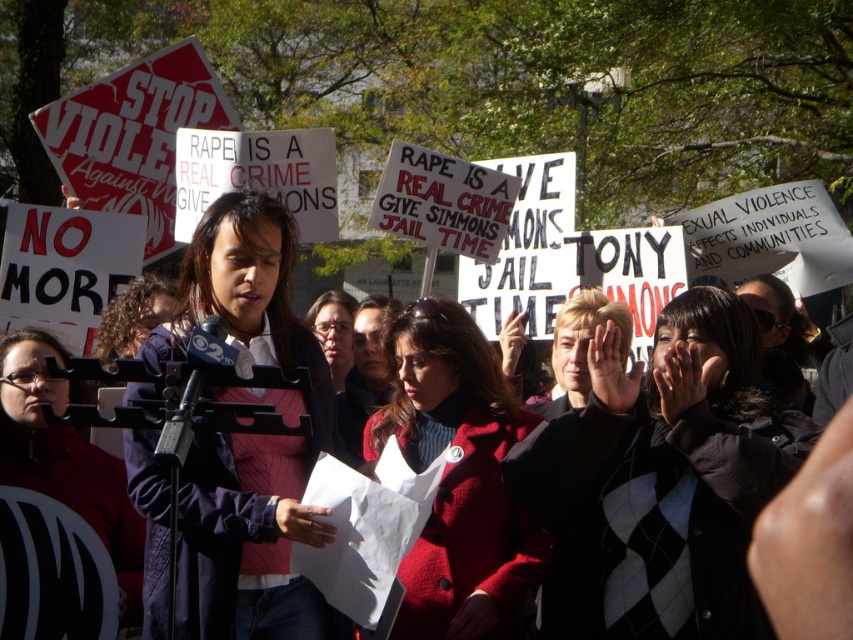
Does point (526, 593) come closer to viewer compared to point (27, 332)?

Yes, point (526, 593) is in front of point (27, 332).

Does red wool coat at center have a lesser width compared to matte black microphone at center?

Indeed, red wool coat at center has a lesser width compared to matte black microphone at center.

This screenshot has width=853, height=640. Describe the element at coordinates (457, 477) in the screenshot. I see `red wool coat at center` at that location.

Identify the location of red wool coat at center. This screenshot has height=640, width=853. (457, 477).

Does black argyle sweater at center appear on the left side of matte black microphone at center?

In fact, black argyle sweater at center is to the right of matte black microphone at center.

Which of these two, black argyle sweater at center or matte black microphone at center, stands taller?

Standing taller between the two is matte black microphone at center.

Between point (624, 529) and point (108, 540), which one is positioned behind?

The point (108, 540) is behind.

What are the coordinates of `black argyle sweater at center` in the screenshot? It's located at (660, 481).

Which is more to the right, black argyle sweater at center or dark blue jacket at center?

black argyle sweater at center

Who is higher up, black argyle sweater at center or dark blue jacket at center?

black argyle sweater at center is above.

This screenshot has height=640, width=853. I want to click on black argyle sweater at center, so click(x=660, y=481).